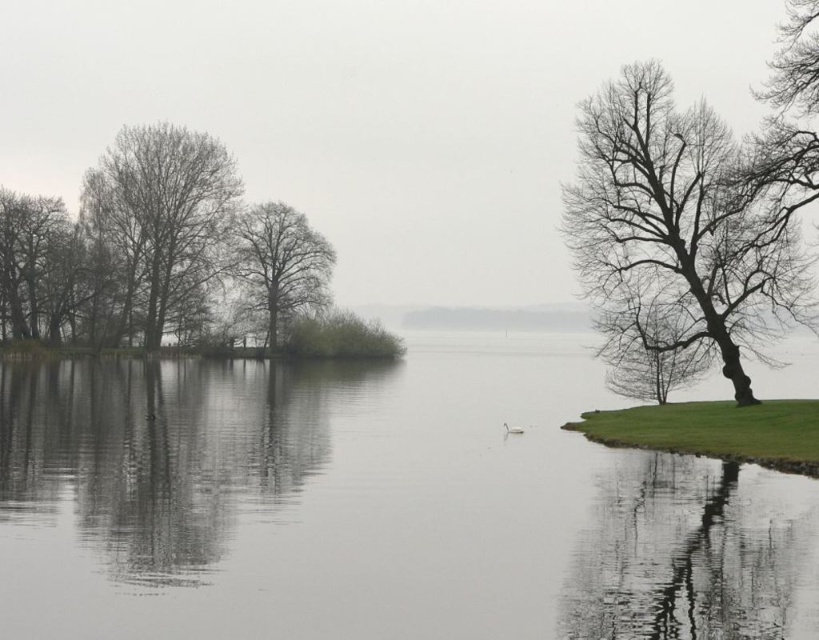
Question: Which point is closer to the camera?

Choices:
 (A) (577, 596)
 (B) (48, 300)

Answer: (A)

Question: Which of these objects is positioned farthest from the brown textured tree at left?

Choices:
 (A) bare wood trees at left
 (B) smooth water at center
 (C) bare wood tree at center
 (D) bare branches tree at right

Answer: (D)

Question: Is bare branches tree at right above bare wood trees at left?

Choices:
 (A) no
 (B) yes

Answer: (A)

Question: Which point is closer to the camera?

Choices:
 (A) (591, 113)
 (B) (150, 132)

Answer: (A)

Question: Is smooth water at center above brown textured tree at left?

Choices:
 (A) yes
 (B) no

Answer: (B)

Question: Can you confirm if smooth water at center is thinner than bare wood trees at left?

Choices:
 (A) yes
 (B) no

Answer: (B)